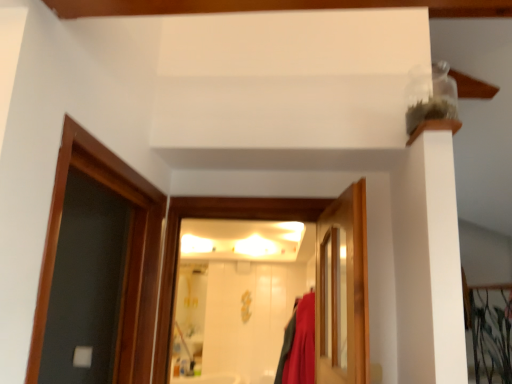
Describe the element at coordinates (343, 290) in the screenshot. I see `wooden door at center, positioned as the second door in left-to-right order` at that location.

This screenshot has height=384, width=512. I want to click on wooden door at center, positioned as the second door in left-to-right order, so click(343, 290).

Measure the distance between wooden door at center, which appears as the first door when viewed from the right, and camera.

wooden door at center, which appears as the first door when viewed from the right, is 4.25 feet away from camera.

Image resolution: width=512 pixels, height=384 pixels. What do you see at coordinates (281, 220) in the screenshot? I see `white glossy door at center, positioned as the 2th door in right-to-left order` at bounding box center [281, 220].

Where is `white glossy door at center, positioned as the 2th door in right-to-left order`? white glossy door at center, positioned as the 2th door in right-to-left order is located at coordinates (281, 220).

Find the location of a particular element. This screenshot has width=512, height=384. wooden door at center, which appears as the first door when viewed from the right is located at coordinates (343, 290).

Which is more to the left, white glossy door at center, which ranks as the 1th door in left-to-right order, or wooden door at center, positioned as the second door in left-to-right order?

white glossy door at center, which ranks as the 1th door in left-to-right order, is more to the left.

Which object is further away from the camera, white glossy door at center, which ranks as the 1th door in left-to-right order, or wooden door at center, positioned as the second door in left-to-right order?

white glossy door at center, which ranks as the 1th door in left-to-right order, is more distant.

Is point (349, 292) positioned in front of point (317, 371)?

Yes, point (349, 292) is in front of point (317, 371).

Looking at this image, from the image's perspective, is white glossy door at center, which ranks as the 1th door in left-to-right order, on top of wooden door at center, positioned as the second door in left-to-right order?

Actually, white glossy door at center, which ranks as the 1th door in left-to-right order, appears below wooden door at center, positioned as the second door in left-to-right order, in the image.

Based on the photo, from a real-world perspective, is white glossy door at center, positioned as the 2th door in right-to-left order, below wooden door at center, positioned as the second door in left-to-right order?

Incorrect, from a real-world perspective, white glossy door at center, positioned as the 2th door in right-to-left order, is higher than wooden door at center, positioned as the second door in left-to-right order.

Considering the relative sizes of white glossy door at center, which ranks as the 1th door in left-to-right order, and wooden door at center, positioned as the second door in left-to-right order, in the image provided, is white glossy door at center, which ranks as the 1th door in left-to-right order, thinner than wooden door at center, positioned as the second door in left-to-right order,?

Incorrect, the width of white glossy door at center, which ranks as the 1th door in left-to-right order, is not less than that of wooden door at center, positioned as the second door in left-to-right order.

From their relative heights in the image, would you say white glossy door at center, which ranks as the 1th door in left-to-right order, is taller or shorter than wooden door at center, positioned as the second door in left-to-right order?

Clearly, white glossy door at center, which ranks as the 1th door in left-to-right order, is taller compared to wooden door at center, positioned as the second door in left-to-right order.

In terms of size, does white glossy door at center, positioned as the 2th door in right-to-left order, appear bigger or smaller than wooden door at center, which appears as the first door when viewed from the right?

In the image, white glossy door at center, positioned as the 2th door in right-to-left order, appears to be larger than wooden door at center, which appears as the first door when viewed from the right.

Would you say white glossy door at center, positioned as the 2th door in right-to-left order, is inside or outside wooden door at center, which appears as the first door when viewed from the right?

white glossy door at center, positioned as the 2th door in right-to-left order, lies outside wooden door at center, which appears as the first door when viewed from the right.

Are white glossy door at center, which ranks as the 1th door in left-to-right order, and wooden door at center, positioned as the second door in left-to-right order, making contact?

There is a gap between white glossy door at center, which ranks as the 1th door in left-to-right order, and wooden door at center, positioned as the second door in left-to-right order.

Does white glossy door at center, positioned as the 2th door in right-to-left order, turn towards wooden door at center, which appears as the first door when viewed from the right?

Yes, white glossy door at center, positioned as the 2th door in right-to-left order, faces towards wooden door at center, which appears as the first door when viewed from the right.

Image resolution: width=512 pixels, height=384 pixels. In order to click on door on the right of white glossy door at center, positioned as the 2th door in right-to-left order in this screenshot , I will do `click(343, 290)`.

Can you confirm if wooden door at center, positioned as the second door in left-to-right order, is positioned to the right of white glossy door at center, positioned as the 2th door in right-to-left order?

Yes, wooden door at center, positioned as the second door in left-to-right order, is to the right of white glossy door at center, positioned as the 2th door in right-to-left order.

In the image, is wooden door at center, positioned as the second door in left-to-right order, positioned in front of or behind white glossy door at center, which ranks as the 1th door in left-to-right order?

In the image, wooden door at center, positioned as the second door in left-to-right order, appears in front of white glossy door at center, which ranks as the 1th door in left-to-right order.

Which is in front, point (350, 382) or point (366, 375)?

The point (366, 375) is more forward.

From the image's perspective, is wooden door at center, which appears as the first door when viewed from the right, over white glossy door at center, which ranks as the 1th door in left-to-right order?

Indeed, from the image's perspective, wooden door at center, which appears as the first door when viewed from the right, is shown above white glossy door at center, which ranks as the 1th door in left-to-right order.

From a real-world perspective, which object stands above the other?

white glossy door at center, positioned as the 2th door in right-to-left order, is physically above.

Based on the photo, looking at their sizes, would you say wooden door at center, positioned as the second door in left-to-right order, is wider or thinner than white glossy door at center, which ranks as the 1th door in left-to-right order?

In the image, wooden door at center, positioned as the second door in left-to-right order, appears to be more narrow than white glossy door at center, which ranks as the 1th door in left-to-right order.

Who is taller, wooden door at center, which appears as the first door when viewed from the right, or white glossy door at center, which ranks as the 1th door in left-to-right order?

Standing taller between the two is white glossy door at center, which ranks as the 1th door in left-to-right order.

Considering the sizes of objects wooden door at center, positioned as the second door in left-to-right order, and white glossy door at center, positioned as the 2th door in right-to-left order, in the image provided, who is bigger, wooden door at center, positioned as the second door in left-to-right order, or white glossy door at center, positioned as the 2th door in right-to-left order,?

Bigger between the two is white glossy door at center, positioned as the 2th door in right-to-left order.

Which is correct: wooden door at center, which appears as the first door when viewed from the right, is inside white glossy door at center, positioned as the 2th door in right-to-left order, or outside of it?

wooden door at center, which appears as the first door when viewed from the right, cannot be found inside white glossy door at center, positioned as the 2th door in right-to-left order.

Is wooden door at center, positioned as the second door in left-to-right order, not near white glossy door at center, positioned as the 2th door in right-to-left order?

No, wooden door at center, positioned as the second door in left-to-right order, is not far away from white glossy door at center, positioned as the 2th door in right-to-left order.

Does wooden door at center, positioned as the second door in left-to-right order, turn towards white glossy door at center, which ranks as the 1th door in left-to-right order?

Yes, wooden door at center, positioned as the second door in left-to-right order, is aimed at white glossy door at center, which ranks as the 1th door in left-to-right order.

Locate an element on the screen. The image size is (512, 384). door lying above the white glossy door at center, which ranks as the 1th door in left-to-right order (from the image's perspective) is located at coordinates (343, 290).

Identify the location of door that appears on the left of wooden door at center, which appears as the first door when viewed from the right. (281, 220).

This screenshot has height=384, width=512. Identify the location of door on the right of white glossy door at center, positioned as the 2th door in right-to-left order. point(343,290).